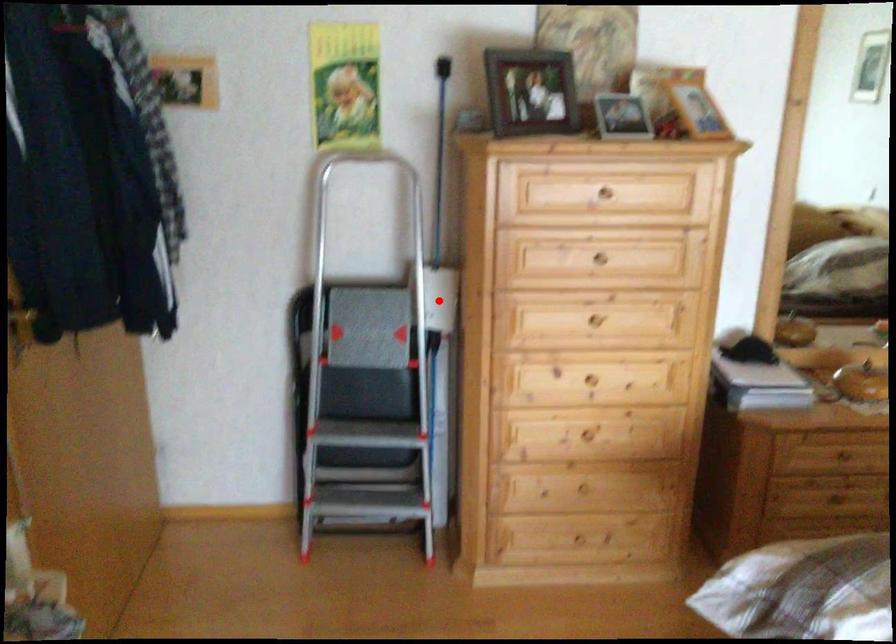
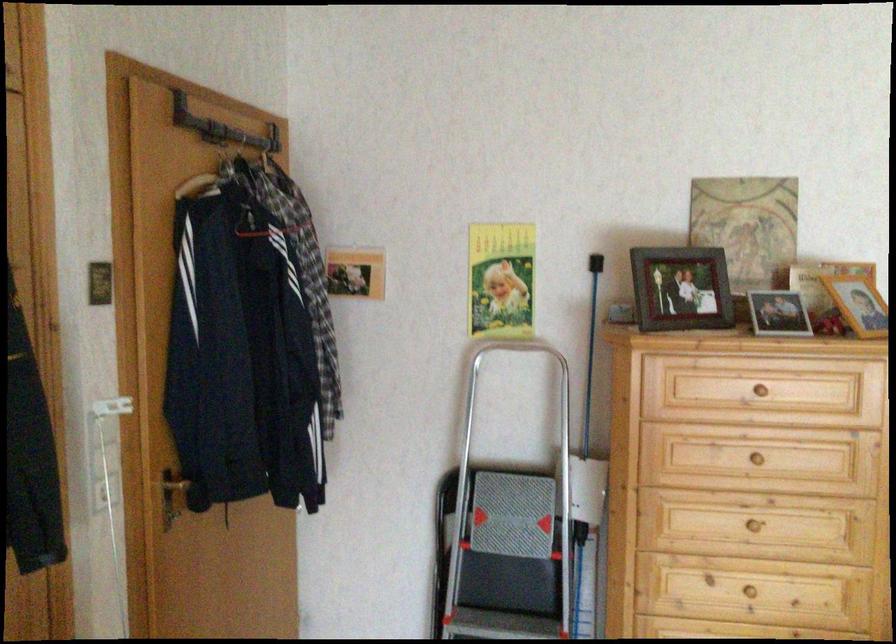
In the second image, find the point that corresponds to the highlighted location in the first image.

(588, 489)